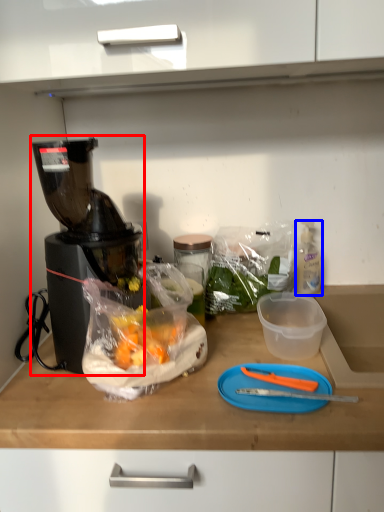
Question: Which object appears farthest to the camera in this image, blender (highlighted by a red box) or bottle (highlighted by a blue box)?

Choices:
 (A) blender
 (B) bottle

Answer: (B)